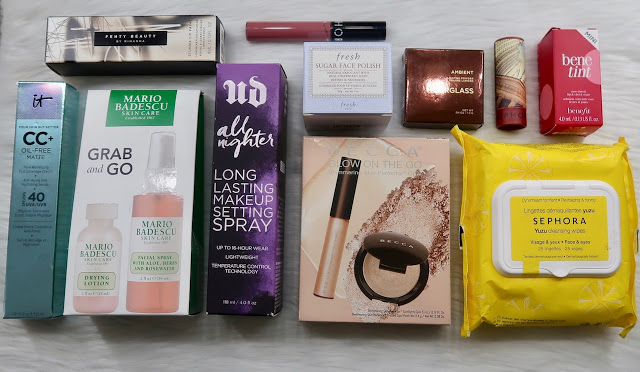
You are a GUI agent. You are given a task and a screenshot of the screen. Output one action in this format:
    pyautogui.click(x=<x>, y=<y>)
    Task: Click on the chopstick
    Image resolution: width=640 pixels, height=372 pixels.
    Given the screenshot: What is the action you would take?
    pyautogui.click(x=356, y=204)